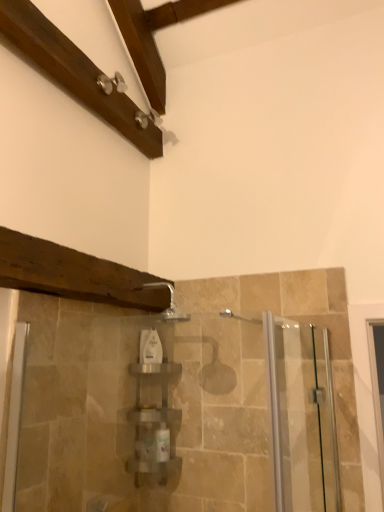
Question: Is white glossy bottle at center surrounded by clear glass screen door at right?

Choices:
 (A) yes
 (B) no

Answer: (B)

Question: From the image's perspective, is clear glass screen door at right located above white glossy bottle at center?

Choices:
 (A) yes
 (B) no

Answer: (B)

Question: Does clear glass screen door at right have a larger size compared to white glossy bottle at center?

Choices:
 (A) yes
 (B) no

Answer: (A)

Question: Considering the relative sizes of clear glass screen door at right and white glossy bottle at center in the image provided, is clear glass screen door at right smaller than white glossy bottle at center?

Choices:
 (A) yes
 (B) no

Answer: (B)

Question: Is clear glass screen door at right taller than white glossy bottle at center?

Choices:
 (A) yes
 (B) no

Answer: (A)

Question: Is clear glass screen door at right shorter than white glossy bottle at center?

Choices:
 (A) no
 (B) yes

Answer: (A)

Question: From the image's perspective, is silver metallic faucet at upper center above clear glass screen door at right?

Choices:
 (A) no
 (B) yes

Answer: (B)

Question: Is silver metallic faucet at upper center wider than clear glass screen door at right?

Choices:
 (A) yes
 (B) no

Answer: (A)

Question: From a real-world perspective, is silver metallic faucet at upper center physically below clear glass screen door at right?

Choices:
 (A) no
 (B) yes

Answer: (A)

Question: Does silver metallic faucet at upper center lie behind clear glass screen door at right?

Choices:
 (A) yes
 (B) no

Answer: (A)

Question: Can you confirm if silver metallic faucet at upper center is positioned to the left of clear glass screen door at right?

Choices:
 (A) yes
 (B) no

Answer: (A)

Question: From a real-world perspective, does silver metallic faucet at upper center stand above clear glass screen door at right?

Choices:
 (A) no
 (B) yes

Answer: (B)

Question: Considering the relative positions of silver metallic faucet at upper center and white glossy bottle at center in the image provided, is silver metallic faucet at upper center behind white glossy bottle at center?

Choices:
 (A) yes
 (B) no

Answer: (B)